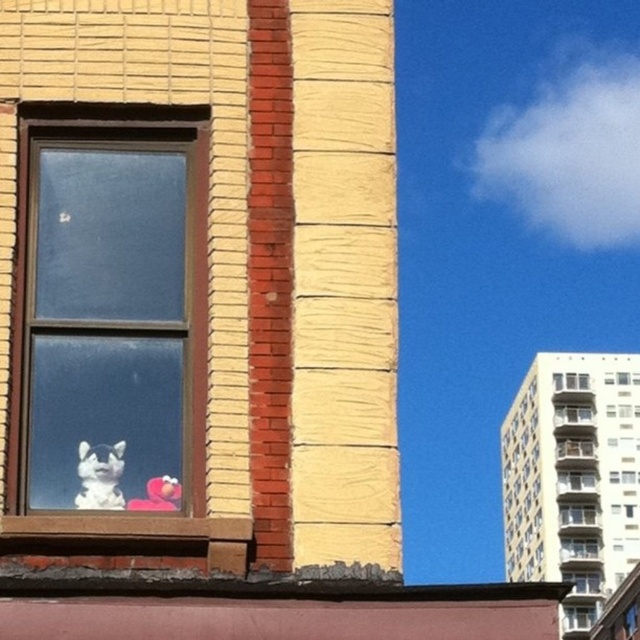
Consider the image. Measure the distance between point (106, 420) and camera.

Point (106, 420) is 13.96 meters away from camera.

Which is below, clear glass window at left or fluffy white cat at window left?

fluffy white cat at window left is lower down.

Does point (177, 472) come behind point (100, 500)?

Yes.

The image size is (640, 640). I want to click on clear glass window at left, so click(109, 308).

Who is shorter, clear glass window at left or clear glass window at upper right?

With less height is clear glass window at upper right.

Who is positioned more to the right, clear glass window at left or clear glass window at upper right?

clear glass window at upper right is more to the right.

Who is more distant from viewer, (42, 291) or (563, 384)?

The point (563, 384) is more distant.

The image size is (640, 640). In order to click on clear glass window at left in this screenshot , I will do `click(109, 308)`.

Who is shorter, fluffy white cat at window left or clear glass window at upper right?

fluffy white cat at window left is shorter.

In the scene shown: Can you confirm if fluffy white cat at window left is positioned below clear glass window at upper right?

No, fluffy white cat at window left is not below clear glass window at upper right.

Which is in front, point (86, 461) or point (570, 388)?

Point (86, 461)

Locate an element on the screen. fluffy white cat at window left is located at coordinates (99, 476).